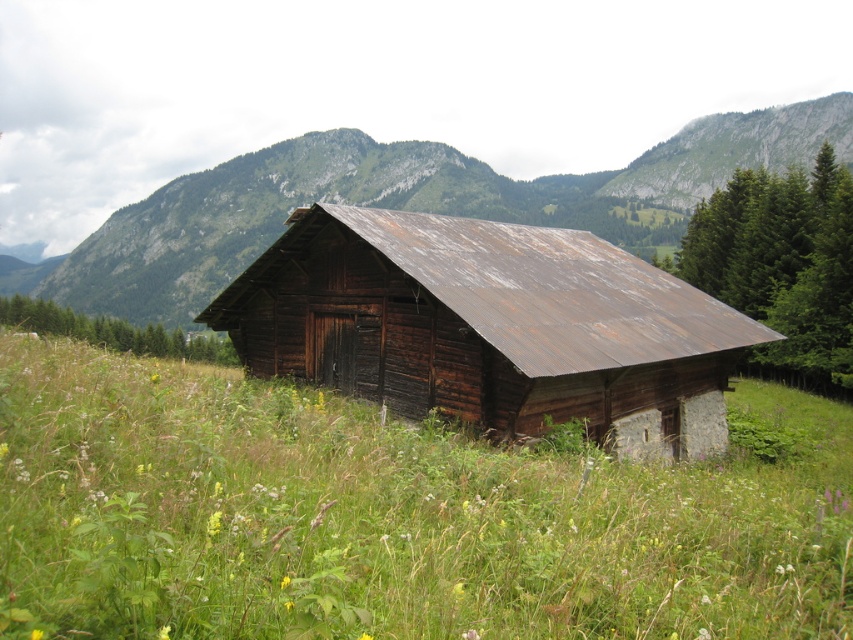
Is point (213, 604) farther from viewer compared to point (329, 380)?

That is False.

Can you confirm if green grassy at center is positioned below weathered wood barn at center?

Correct, green grassy at center is located below weathered wood barn at center.

You are a GUI agent. You are given a task and a screenshot of the screen. Output one action in this format:
    pyautogui.click(x=<x>, y=<y>)
    Task: Click on the green grassy at center
    This screenshot has height=640, width=853.
    Given the screenshot: What is the action you would take?
    pyautogui.click(x=392, y=516)